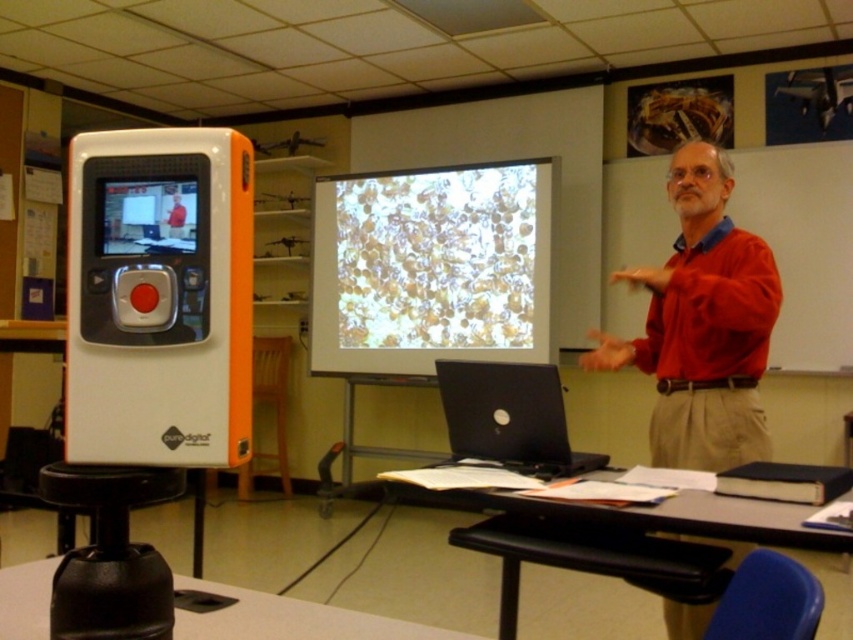
Question: Among these points, which one is nearest to the camera?

Choices:
 (A) (756, 458)
 (B) (625, 509)
 (C) (175, 188)

Answer: (C)

Question: Is black matte laptop at center wider than matte black screen at center?

Choices:
 (A) yes
 (B) no

Answer: (A)

Question: Does smooth black table at lower center have a lesser width compared to matte black screen at center?

Choices:
 (A) yes
 (B) no

Answer: (B)

Question: Can you confirm if smooth black table at lower center is positioned to the right of matte black screen at center?

Choices:
 (A) no
 (B) yes

Answer: (B)

Question: Which point is farther to the camera?

Choices:
 (A) black plastic table at lower left
 (B) black matte laptop at center
 (C) red matte shirt at center

Answer: (C)

Question: Among these points, which one is nearest to the camera?

Choices:
 (A) (462, 476)
 (B) (643, 324)
 (C) (474, 433)
 (D) (16, 604)

Answer: (D)